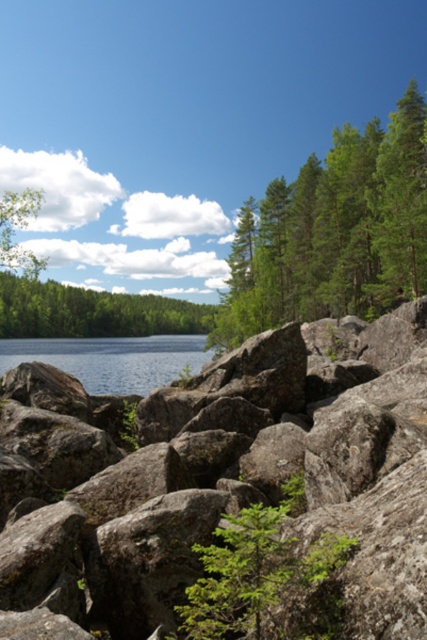
Is point (119, 484) less distant than point (142, 300)?

That is True.

Is gray rough boulder at center thinner than green leafy trees at center?

Yes.

You are a GUI agent. You are given a task and a screenshot of the screen. Output one action in this format:
    pyautogui.click(x=<x>, y=<y>)
    Task: Click on the gray rough boulder at center
    The width and height of the screenshot is (427, 640).
    Given the screenshot: What is the action you would take?
    pyautogui.click(x=222, y=492)

This screenshot has width=427, height=640. Find the location of `gray rough boulder at center`. gray rough boulder at center is located at coordinates (222, 492).

Does green leafy tree at upper right appear over green leafy tree at center?

Yes.

Does point (246, 224) come in front of point (204, 593)?

No, it is not.

This screenshot has height=640, width=427. I want to click on green leafy tree at upper right, so click(x=333, y=230).

In the scene shown: Does gray rough boulder at center lie behind green leafy tree at upper right?

No, it is in front of green leafy tree at upper right.

Is point (175, 628) closer to camera compared to point (417, 218)?

Yes.

What do you see at coordinates (222, 492) in the screenshot? Image resolution: width=427 pixels, height=640 pixels. I see `gray rough boulder at center` at bounding box center [222, 492].

At what (x,y) coordinates should I click in order to perform the action: click on gray rough boulder at center. Please return your answer as a coordinate pair (x, y). This screenshot has height=640, width=427. Looking at the image, I should click on (222, 492).